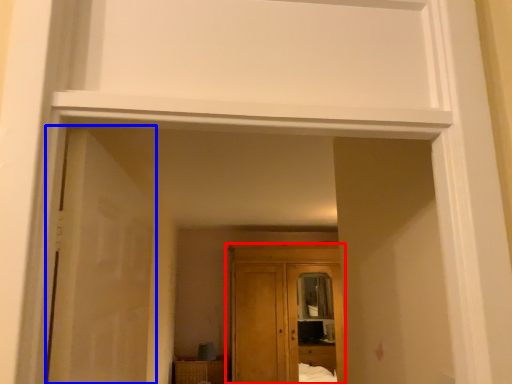
Question: Which point is further to the camera, cupboard (highlighted by a red box) or door (highlighted by a blue box)?

Choices:
 (A) cupboard
 (B) door

Answer: (A)